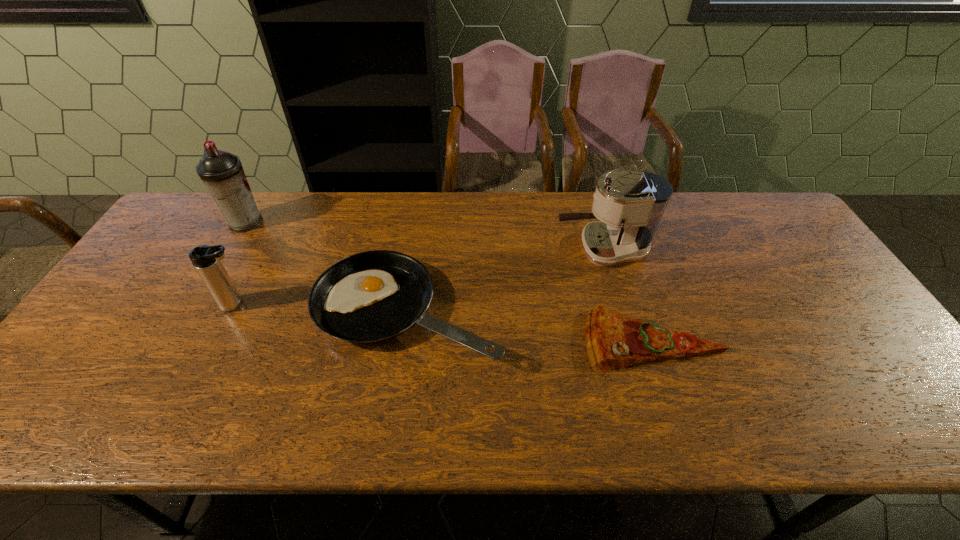
Identify the location of aerosol can. (222, 173).

At what (x,y) coordinates should I click in order to perform the action: click on coffee maker. Please return your answer as a coordinate pair (x, y). Looking at the image, I should click on (630, 205).

You are a GUI agent. You are given a task and a screenshot of the screen. Output one action in this format:
    pyautogui.click(x=<x>, y=<y>)
    Task: Click on the second object from left to right
    This screenshot has width=960, height=540.
    Given the screenshot: What is the action you would take?
    pyautogui.click(x=206, y=259)

Image resolution: width=960 pixels, height=540 pixels. Find the location of `thermos bottle`. thermos bottle is located at coordinates (206, 259).

I want to click on the fourth tallest object, so click(x=372, y=296).

In order to click on the third object from left to right in this screenshot , I will do tap(372, 296).

This screenshot has width=960, height=540. I want to click on the shortest object, so click(x=613, y=340).

Locate an element on the screen. blank space located 0.060m on the back of the aerosol can is located at coordinates (258, 200).

At what (x,y) coordinates should I click in order to perform the action: click on vacant space situated on the front-facing side of the coffee maker. Please return your answer as a coordinate pair (x, y). Image resolution: width=960 pixels, height=540 pixels. Looking at the image, I should click on (538, 249).

Locate an element on the screen. Image resolution: width=960 pixels, height=540 pixels. free space located 0.350m on the front-facing side of the coffee maker is located at coordinates (438, 249).